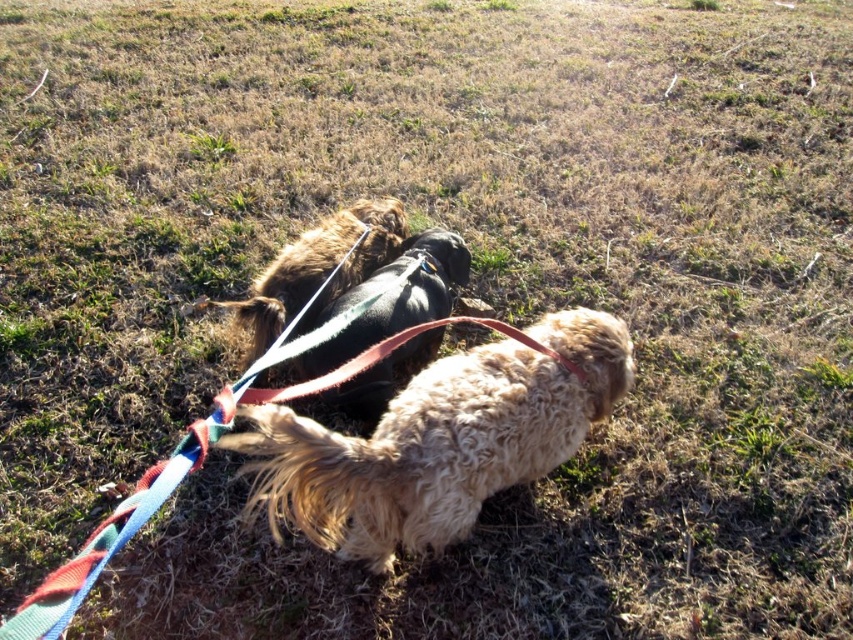
You are a photographer trying to capture a group photo of the fuzzy fur dog at center and the shiny black dog at center. If you want to ensure both dogs are fully visible in the frame, which dog should you position closer to the camera to avoid cropping?

You should position the fuzzy fur dog at center closer to the camera because it is wider than the shiny black dog at center, so placing it closer ensures it fits without cropping while still showing the shiny black dog at center in the background.

Looking at this image, you are a photographer trying to capture a clear photo of the shiny black dog at center and the fuzzy brown dog at center. Which dog will have its head higher in the photo?

The shiny black dog at center has a greater height compared to the fuzzy brown dog at center, so its head will be higher in the photo.